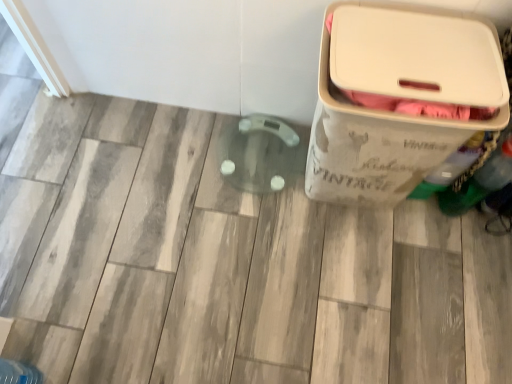
This screenshot has height=384, width=512. In order to click on free spot in front of beige plastic container at right in this screenshot , I will do `click(354, 272)`.